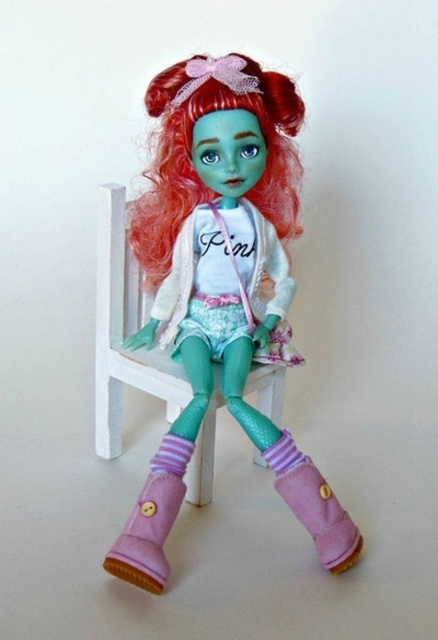
Question: Can you confirm if matte pink boots at center is positioned above shiny red hair at center?

Choices:
 (A) yes
 (B) no

Answer: (B)

Question: Which point is closer to the camera taking this photo?

Choices:
 (A) (170, 444)
 (B) (95, 385)
 (C) (229, 83)

Answer: (C)

Question: Which of the following is the closest to the observer?

Choices:
 (A) (193, 56)
 (B) (151, 500)

Answer: (B)

Question: Does matte pink boots at center have a greater width compared to white wooden chair at center?

Choices:
 (A) no
 (B) yes

Answer: (B)

Question: Estimate the real-world distances between objects in this image. Which object is farther from the matte white dress at center?

Choices:
 (A) matte pink boots at center
 (B) white wooden chair at center
 (C) pink striped sock at lower center
 (D) shiny red hair at center

Answer: (C)

Question: Can you confirm if shiny red hair at center is wider than white wooden chair at center?

Choices:
 (A) no
 (B) yes

Answer: (A)